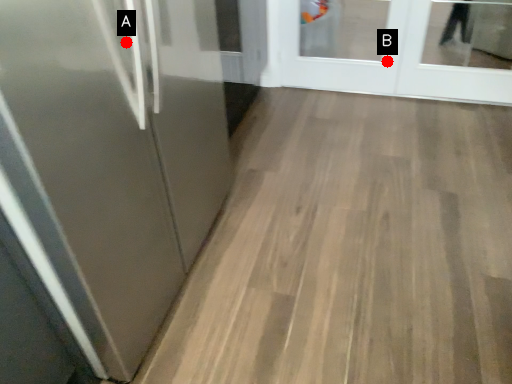
Question: Two points are circled on the image, labeled by A and B beside each circle. Which point appears farthest from the camera in this image?

Choices:
 (A) A is further
 (B) B is further

Answer: (B)